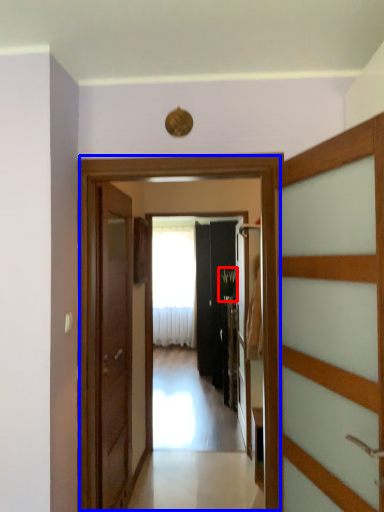
Question: Which object is further to the camera taking this photo, plant (highlighted by a red box) or elevator (highlighted by a blue box)?

Choices:
 (A) plant
 (B) elevator

Answer: (A)